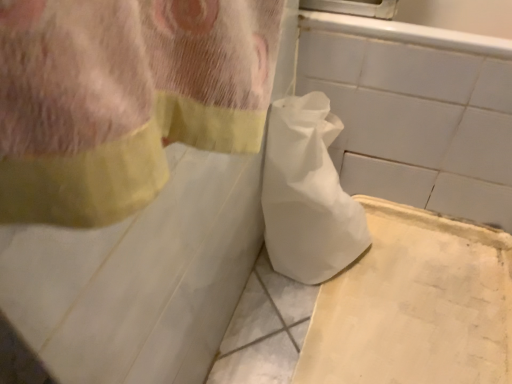
At what (x,y) coordinates should I click in order to perform the action: click on free point below white cardboard at lower right (from a real-world perspective). Please return your answer as a coordinate pair (x, y). This screenshot has width=512, height=384. Looking at the image, I should click on (423, 302).